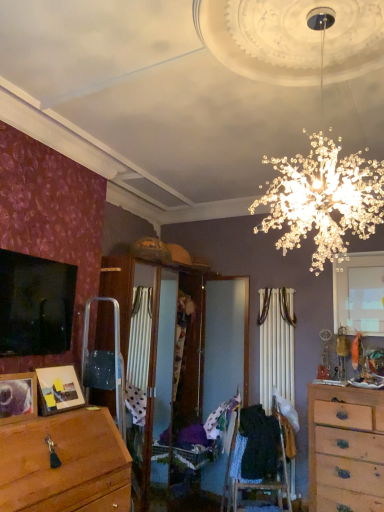
The width and height of the screenshot is (384, 512). Describe the element at coordinates (345, 449) in the screenshot. I see `wooden chest of drawers at right` at that location.

What do you see at coordinates (359, 293) in the screenshot? I see `white matte window at upper right` at bounding box center [359, 293].

Locate an element on the screen. The height and width of the screenshot is (512, 384). black fabric at center, marked as the 1th clothing in a right-to-left arrangement is located at coordinates (259, 444).

This screenshot has height=512, width=384. What do you see at coordinates (17, 397) in the screenshot?
I see `wooden photo frame at lower left` at bounding box center [17, 397].

Where is `wooden chest of drawers at right`? wooden chest of drawers at right is located at coordinates (345, 449).

Who is bigger, white matte window at upper right or wooden chest of drawers at right?

wooden chest of drawers at right is bigger.

Is white matte window at upper right inside or outside of wooden chest of drawers at right?

white matte window at upper right is located beyond the bounds of wooden chest of drawers at right.

Who is shorter, white matte window at upper right or wooden chest of drawers at right?

With less height is white matte window at upper right.

From a real-world perspective, relative to wooden chest of drawers at right, is white matte window at upper right vertically above or below?

From a real-world perspective, white matte window at upper right is physically above wooden chest of drawers at right.

From the image's perspective, is wooden photo frame at lower left beneath patterned fabric at center, acting as the second clothing starting from the right?

No.

Consider the image. From a real-world perspective, is wooden photo frame at lower left physically below patterned fabric at center, which is counted as the first clothing, starting from the left?

No, from a real-world perspective, wooden photo frame at lower left is not beneath patterned fabric at center, which is counted as the first clothing, starting from the left.

Between wooden photo frame at lower left and patterned fabric at center, acting as the second clothing starting from the right, which one has smaller size?

wooden photo frame at lower left.

Which is in front, wooden photo frame at lower left or patterned fabric at center, acting as the second clothing starting from the right?

wooden photo frame at lower left is more forward.

Does black fabric at center, which is the second clothing from left to right, appear on the right side of wooden photo frame at lower left?

Correct, you'll find black fabric at center, which is the second clothing from left to right, to the right of wooden photo frame at lower left.

Can wooden photo frame at lower left be found inside black fabric at center, marked as the 1th clothing in a right-to-left arrangement?

No, wooden photo frame at lower left is not surrounded by black fabric at center, marked as the 1th clothing in a right-to-left arrangement.

From a real-world perspective, is black fabric at center, marked as the 1th clothing in a right-to-left arrangement, physically located above or below wooden photo frame at lower left?

In terms of real-world spatial position, black fabric at center, marked as the 1th clothing in a right-to-left arrangement, is below wooden photo frame at lower left.

Looking at the image, does black fabric at center, marked as the 1th clothing in a right-to-left arrangement, seem bigger or smaller compared to wooden photo frame at lower left?

Considering their sizes, black fabric at center, marked as the 1th clothing in a right-to-left arrangement, takes up more space than wooden photo frame at lower left.

How much distance is there between patterned fabric at center, acting as the second clothing starting from the right, and black fabric at center, marked as the 1th clothing in a right-to-left arrangement?

patterned fabric at center, acting as the second clothing starting from the right, and black fabric at center, marked as the 1th clothing in a right-to-left arrangement, are 10.02 inches apart from each other.

Considering the relative sizes of patterned fabric at center, acting as the second clothing starting from the right, and black fabric at center, marked as the 1th clothing in a right-to-left arrangement, in the image provided, is patterned fabric at center, acting as the second clothing starting from the right, bigger than black fabric at center, marked as the 1th clothing in a right-to-left arrangement,?

Actually, patterned fabric at center, acting as the second clothing starting from the right, might be smaller than black fabric at center, marked as the 1th clothing in a right-to-left arrangement.

Considering the sizes of objects patterned fabric at center, which is counted as the first clothing, starting from the left, and black fabric at center, marked as the 1th clothing in a right-to-left arrangement, in the image provided, who is shorter, patterned fabric at center, which is counted as the first clothing, starting from the left, or black fabric at center, marked as the 1th clothing in a right-to-left arrangement,?

patterned fabric at center, which is counted as the first clothing, starting from the left, is shorter.

From the image's perspective, which object appears higher, patterned fabric at center, which is counted as the first clothing, starting from the left, or black fabric at center, marked as the 1th clothing in a right-to-left arrangement?

patterned fabric at center, which is counted as the first clothing, starting from the left, appears higher in the image.

From a real-world perspective, is black fabric at center, marked as the 1th clothing in a right-to-left arrangement, above or below white matte window at upper right?

From a real-world perspective, black fabric at center, marked as the 1th clothing in a right-to-left arrangement, is physically below white matte window at upper right.

Consider the image. In terms of height, does black fabric at center, marked as the 1th clothing in a right-to-left arrangement, look taller or shorter compared to white matte window at upper right?

Clearly, black fabric at center, marked as the 1th clothing in a right-to-left arrangement, is shorter compared to white matte window at upper right.

From the image's perspective, is black fabric at center, marked as the 1th clothing in a right-to-left arrangement, on top of white matte window at upper right?

Actually, black fabric at center, marked as the 1th clothing in a right-to-left arrangement, appears below white matte window at upper right in the image.

Is black fabric at center, which is the second clothing from left to right, far from white matte window at upper right?

Yes, black fabric at center, which is the second clothing from left to right, is far from white matte window at upper right.

From a real-world perspective, does wooden chest of drawers at right sit lower than patterned fabric at center, acting as the second clothing starting from the right?

Yes, from a real-world perspective, wooden chest of drawers at right is beneath patterned fabric at center, acting as the second clothing starting from the right.

Considering the relative sizes of wooden chest of drawers at right and patterned fabric at center, which is counted as the first clothing, starting from the left, in the image provided, is wooden chest of drawers at right shorter than patterned fabric at center, which is counted as the first clothing, starting from the left,?

No.

In the scene shown: Can you confirm if wooden chest of drawers at right is positioned to the left of patterned fabric at center, which is counted as the first clothing, starting from the left?

No.

From the picture: From the image's perspective, would you say wooden chest of drawers at right is shown under patterned fabric at center, acting as the second clothing starting from the right?

Yes.

Does point (267, 466) come behind point (348, 404)?

Yes, point (267, 466) is farther from viewer.

Is wooden chest of drawers at right surrounded by black fabric at center, which is the second clothing from left to right?

No, wooden chest of drawers at right is not inside black fabric at center, which is the second clothing from left to right.

Between black fabric at center, marked as the 1th clothing in a right-to-left arrangement, and wooden chest of drawers at right, which one is positioned in front?

wooden chest of drawers at right is closer to the camera.

How many degrees apart are the facing directions of black fabric at center, marked as the 1th clothing in a right-to-left arrangement, and wooden chest of drawers at right?

27.7 degrees.

There is a wooden chest of drawers at right. At what (x,y) coordinates should I click in order to perform the action: click on window above it (from a real-world perspective). Please return your answer as a coordinate pair (x, y). Looking at the image, I should click on (359, 293).

I want to click on picture frame in front of the patterned fabric at center, acting as the second clothing starting from the right, so click(x=17, y=397).

Estimate the real-world distances between objects in this image. Which object is further from wooden chest of drawers at right, wooden photo frame at lower left or black fabric at center, which is the second clothing from left to right?

wooden photo frame at lower left.

From the image, which object appears to be nearer to black fabric at center, which is the second clothing from left to right, wooden photo frame at lower left or patterned fabric at center, acting as the second clothing starting from the right?

patterned fabric at center, acting as the second clothing starting from the right, is closer to black fabric at center, which is the second clothing from left to right.

From the image, which object appears to be farther from wooden photo frame at lower left, black fabric at center, which is the second clothing from left to right, or white matte window at upper right?

white matte window at upper right is further to wooden photo frame at lower left.

Looking at the image, which one is located closer to wooden photo frame at lower left, wooden chest of drawers at right or black fabric at center, marked as the 1th clothing in a right-to-left arrangement?

black fabric at center, marked as the 1th clothing in a right-to-left arrangement, is positioned closer to the anchor wooden photo frame at lower left.

Considering their positions, is wooden chest of drawers at right positioned closer to white matte window at upper right than patterned fabric at center, acting as the second clothing starting from the right?

The object closer to white matte window at upper right is wooden chest of drawers at right.

Estimate the real-world distances between objects in this image. Which object is closer to wooden chest of drawers at right, patterned fabric at center, which is counted as the first clothing, starting from the left, or white matte window at upper right?

patterned fabric at center, which is counted as the first clothing, starting from the left, lies closer to wooden chest of drawers at right than the other object.

Looking at the image, which one is located further to white matte window at upper right, wooden photo frame at lower left or patterned fabric at center, acting as the second clothing starting from the right?

Among the two, wooden photo frame at lower left is located further to white matte window at upper right.

Estimate the real-world distances between objects in this image. Which object is further from patterned fabric at center, which is counted as the first clothing, starting from the left, wooden photo frame at lower left or white matte window at upper right?

wooden photo frame at lower left is positioned further to the anchor patterned fabric at center, which is counted as the first clothing, starting from the left.

Identify the location of the chest of drawers located between wooden photo frame at lower left and white matte window at upper right in the left-right direction. This screenshot has width=384, height=512. (345, 449).

In order to click on clothing between patterned fabric at center, acting as the second clothing starting from the right, and white matte window at upper right in this screenshot , I will do `click(259, 444)`.

I want to click on clothing located between patterned fabric at center, acting as the second clothing starting from the right, and wooden chest of drawers at right in the left-right direction, so click(259, 444).

The image size is (384, 512). I want to click on clothing between wooden photo frame at lower left and black fabric at center, which is the second clothing from left to right, from left to right, so click(x=222, y=421).